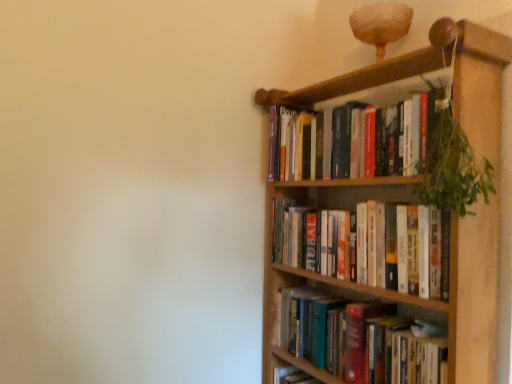
Measure the distance between hardcover books at upper right, which appears as the 2th book when viewed from the top, and camera.

hardcover books at upper right, which appears as the 2th book when viewed from the top, and camera are 1.01 meters apart.

Describe the element at coordinates (452, 163) in the screenshot. I see `green leafy plant at upper right` at that location.

Describe the element at coordinates (350, 140) in the screenshot. The width and height of the screenshot is (512, 384). I see `hardcover books at upper right, which is the 1th book in top-to-bottom order` at that location.

The width and height of the screenshot is (512, 384). In order to click on hardcover books at right, marked as the 1th book in a bottom-to-top arrangement in this screenshot , I will do `click(361, 340)`.

Who is taller, wooden bookcase at upper right or hardcover books at upper right, the 2th book positioned from the bottom?

With more height is wooden bookcase at upper right.

Between wooden bookcase at upper right and hardcover books at upper right, which appears as the 2th book when viewed from the top, which one appears on the left side from the viewer's perspective?

Positioned to the left is hardcover books at upper right, which appears as the 2th book when viewed from the top.

How far apart are wooden bookcase at upper right and hardcover books at upper right, which appears as the 2th book when viewed from the top?

The distance of wooden bookcase at upper right from hardcover books at upper right, which appears as the 2th book when viewed from the top, is 5.72 inches.

In the image, is wooden bookcase at upper right positioned in front of or behind hardcover books at upper right, which appears as the 2th book when viewed from the top?

wooden bookcase at upper right is positioned closer to the viewer than hardcover books at upper right, which appears as the 2th book when viewed from the top.

From the image's perspective, which one is positioned higher, hardcover books at upper right, which is the 1th book in top-to-bottom order, or wooden bookcase at upper right?

hardcover books at upper right, which is the 1th book in top-to-bottom order, is shown above in the image.

Can you tell me how much hardcover books at upper right, which is the 1th book in top-to-bottom order, and wooden bookcase at upper right differ in facing direction?

2.32 degrees.

Is point (305, 155) behind point (416, 53)?

Yes, point (305, 155) is farther from viewer.

Looking at their sizes, would you say hardcover books at upper right, which is the 1th book in top-to-bottom order, is wider or thinner than wooden bookcase at upper right?

hardcover books at upper right, which is the 1th book in top-to-bottom order, is thinner than wooden bookcase at upper right.

Between point (305, 136) and point (321, 358), which one is positioned behind?

The point (305, 136) is farther.

From the picture: Considering the positions of objects hardcover books at upper right, which is the 1th book in top-to-bottom order, and hardcover books at right, marked as the 1th book in a bottom-to-top arrangement, in the image provided, who is more to the left, hardcover books at upper right, which is the 1th book in top-to-bottom order, or hardcover books at right, marked as the 1th book in a bottom-to-top arrangement,?

hardcover books at upper right, which is the 1th book in top-to-bottom order, is more to the left.

Considering the sizes of hardcover books at upper right, the 3th book in the bottom-to-top sequence, and hardcover books at right, marked as the 1th book in a bottom-to-top arrangement, in the image, is hardcover books at upper right, the 3th book in the bottom-to-top sequence, taller or shorter than hardcover books at right, marked as the 1th book in a bottom-to-top arrangement,?

hardcover books at upper right, the 3th book in the bottom-to-top sequence, is taller than hardcover books at right, marked as the 1th book in a bottom-to-top arrangement.

Between hardcover books at right, marked as the 1th book in a bottom-to-top arrangement, and hardcover books at upper right, the 3th book in the bottom-to-top sequence, which one is positioned in front?

hardcover books at upper right, the 3th book in the bottom-to-top sequence, is in front.

Is hardcover books at right, marked as the 1th book in a bottom-to-top arrangement, in contact with hardcover books at upper right, the 3th book in the bottom-to-top sequence?

hardcover books at right, marked as the 1th book in a bottom-to-top arrangement, is not next to hardcover books at upper right, the 3th book in the bottom-to-top sequence, and they're not touching.

Between point (416, 377) and point (436, 98), which one is positioned behind?

Positioned behind is point (416, 377).

Is hardcover books at upper right, which is the 1th book in top-to-bottom order, surrounded by hardcover books at right, marked as the third book in a top-to-bottom arrangement?

No, hardcover books at upper right, which is the 1th book in top-to-bottom order, is not a part of hardcover books at right, marked as the third book in a top-to-bottom arrangement.

Looking at their sizes, would you say hardcover books at upper right, which is the 1th book in top-to-bottom order, is wider or thinner than hardcover books at upper right, the 2th book positioned from the bottom?

Considering their sizes, hardcover books at upper right, which is the 1th book in top-to-bottom order, looks slimmer than hardcover books at upper right, the 2th book positioned from the bottom.

What are the coordinates of `book that is the 1st object located behind the hardcover books at upper right, the 2th book positioned from the bottom` in the screenshot? It's located at (350, 140).

Is hardcover books at upper right, the 3th book in the bottom-to-top sequence, in contact with hardcover books at upper right, the 2th book positioned from the bottom?

No, hardcover books at upper right, the 3th book in the bottom-to-top sequence, is not touching hardcover books at upper right, the 2th book positioned from the bottom.

From the image's perspective, which object appears higher, green leafy plant at upper right or hardcover books at right, marked as the third book in a top-to-bottom arrangement?

green leafy plant at upper right appears higher in the image.

How many degrees apart are the facing directions of green leafy plant at upper right and hardcover books at right, marked as the 1th book in a bottom-to-top arrangement?

There is a 1.37-degree angle between the facing directions of green leafy plant at upper right and hardcover books at right, marked as the 1th book in a bottom-to-top arrangement.

Considering the sizes of green leafy plant at upper right and hardcover books at right, marked as the 1th book in a bottom-to-top arrangement, in the image, is green leafy plant at upper right wider or thinner than hardcover books at right, marked as the 1th book in a bottom-to-top arrangement,?

Clearly, green leafy plant at upper right has less width compared to hardcover books at right, marked as the 1th book in a bottom-to-top arrangement.

Is hardcover books at right, marked as the 1th book in a bottom-to-top arrangement, wider than wooden bookcase at upper right?

No.

Is point (298, 366) more distant than point (459, 30)?

Yes, point (298, 366) is behind point (459, 30).

From the image's perspective, which is above, hardcover books at right, marked as the third book in a top-to-bottom arrangement, or wooden bookcase at upper right?

wooden bookcase at upper right appears higher in the image.

Would you say hardcover books at right, marked as the 1th book in a bottom-to-top arrangement, contains wooden bookcase at upper right?

Definitely not — wooden bookcase at upper right is not inside hardcover books at right, marked as the 1th book in a bottom-to-top arrangement.

You are a GUI agent. You are given a task and a screenshot of the screen. Output one action in this format:
    pyautogui.click(x=<x>, y=<y>)
    Task: Click on the bookcase that appears below the hardcover books at upper right, the 2th book positioned from the bottom (from the image's perspective)
    
    Given the screenshot: What is the action you would take?
    (x=474, y=296)

From a real-world perspective, which book is the 2nd one above the wooden bookcase at upper right? Please provide its 2D coordinates.

[(350, 140)]

Estimate the real-world distances between objects in this image. Which object is closer to hardcover books at right, marked as the third book in a top-to-bottom arrangement, green leafy plant at upper right or wooden bookcase at upper right?

wooden bookcase at upper right.

Looking at the image, which one is located further to hardcover books at right, marked as the third book in a top-to-bottom arrangement, hardcover books at upper right, which appears as the 2th book when viewed from the top, or green leafy plant at upper right?

Among the two, green leafy plant at upper right is located further to hardcover books at right, marked as the third book in a top-to-bottom arrangement.

Which object lies further to the anchor point hardcover books at upper right, which appears as the 2th book when viewed from the top, wooden bookcase at upper right or hardcover books at upper right, the 3th book in the bottom-to-top sequence?

hardcover books at upper right, the 3th book in the bottom-to-top sequence, is further to hardcover books at upper right, which appears as the 2th book when viewed from the top.

When comparing their distances from green leafy plant at upper right, does hardcover books at right, marked as the third book in a top-to-bottom arrangement, or hardcover books at upper right, the 2th book positioned from the bottom, seem further?

hardcover books at right, marked as the third book in a top-to-bottom arrangement.

Looking at the image, which one is located closer to hardcover books at right, marked as the third book in a top-to-bottom arrangement, hardcover books at upper right, which appears as the 2th book when viewed from the top, or hardcover books at upper right, which is the 1th book in top-to-bottom order?

hardcover books at upper right, which appears as the 2th book when viewed from the top, is positioned closer to the anchor hardcover books at right, marked as the third book in a top-to-bottom arrangement.

Considering their positions, is wooden bookcase at upper right positioned further to green leafy plant at upper right than hardcover books at upper right, the 3th book in the bottom-to-top sequence?

hardcover books at upper right, the 3th book in the bottom-to-top sequence, lies further to green leafy plant at upper right than the other object.

Estimate the real-world distances between objects in this image. Which object is further from hardcover books at right, marked as the third book in a top-to-bottom arrangement, wooden bookcase at upper right or hardcover books at upper right, the 3th book in the bottom-to-top sequence?

Among the two, hardcover books at upper right, the 3th book in the bottom-to-top sequence, is located further to hardcover books at right, marked as the third book in a top-to-bottom arrangement.

Looking at the image, which one is located further to hardcover books at upper right, which appears as the 2th book when viewed from the top, hardcover books at upper right, which is the 1th book in top-to-bottom order, or hardcover books at right, marked as the third book in a top-to-bottom arrangement?

hardcover books at upper right, which is the 1th book in top-to-bottom order, is positioned further to the anchor hardcover books at upper right, which appears as the 2th book when viewed from the top.

Identify the location of vegetation between hardcover books at upper right, which is the 1th book in top-to-bottom order, and hardcover books at upper right, the 2th book positioned from the bottom, in the up-down direction. (452, 163).

Find the location of a particular element. The image size is (512, 384). bookcase between hardcover books at upper right, which appears as the 2th book when viewed from the top, and hardcover books at right, marked as the 1th book in a bottom-to-top arrangement, in the up-down direction is located at coordinates (474, 296).

Where is `bookcase between hardcover books at upper right, which is the 1th book in top-to-bottom order, and hardcover books at right, marked as the 1th book in a bottom-to-top arrangement, in the up-down direction`? The width and height of the screenshot is (512, 384). bookcase between hardcover books at upper right, which is the 1th book in top-to-bottom order, and hardcover books at right, marked as the 1th book in a bottom-to-top arrangement, in the up-down direction is located at coordinates (474, 296).

Locate an element on the screen. book that lies between green leafy plant at upper right and wooden bookcase at upper right from top to bottom is located at coordinates (368, 245).